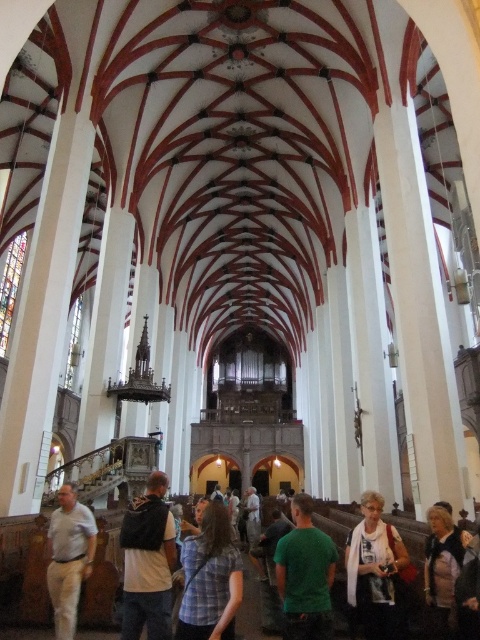
Consider the image. You are a photographer standing in the historic church and want to take a photo of both the green matte shirt at center and the light beige cotton shirt at center. Which shirt should you focus on first if you want to capture the one that is taller?

The green matte shirt at center is taller than the light beige cotton shirt at center, so you should focus on the green matte shirt at center first.

You are standing in the historic church and see two shirts at the center area. The green matte shirt at center and the light beige cotton shirt at center. Which shirt is positioned more to the right?

The green matte shirt at center is positioned more to the right than the light beige cotton shirt at center.